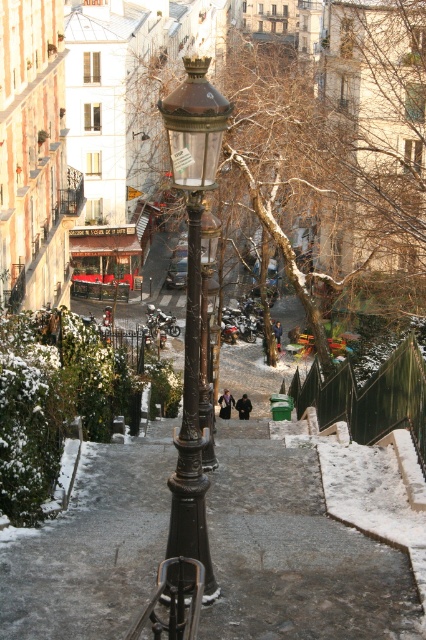
Question: Does bronze/golden lamppost at center have a lesser width compared to bronze/marble street light at center?

Choices:
 (A) no
 (B) yes

Answer: (A)

Question: Estimate the real-world distances between objects in this image. Which object is farther from the bare branches at center?

Choices:
 (A) bronze/marble street light at center
 (B) bronze/golden lamppost at center

Answer: (B)

Question: Which of the following is the closest to the observer?

Choices:
 (A) (213, 433)
 (B) (203, 100)

Answer: (B)

Question: Does bare branches at center appear over bronze/golden lamppost at center?

Choices:
 (A) yes
 (B) no

Answer: (A)

Question: Does bare branches at center appear under bronze/marble street light at center?

Choices:
 (A) no
 (B) yes

Answer: (A)

Question: Considering the real-world distances, which object is farthest from the bronze/marble street light at center?

Choices:
 (A) bronze/golden lamppost at center
 (B) bare branches at center

Answer: (B)